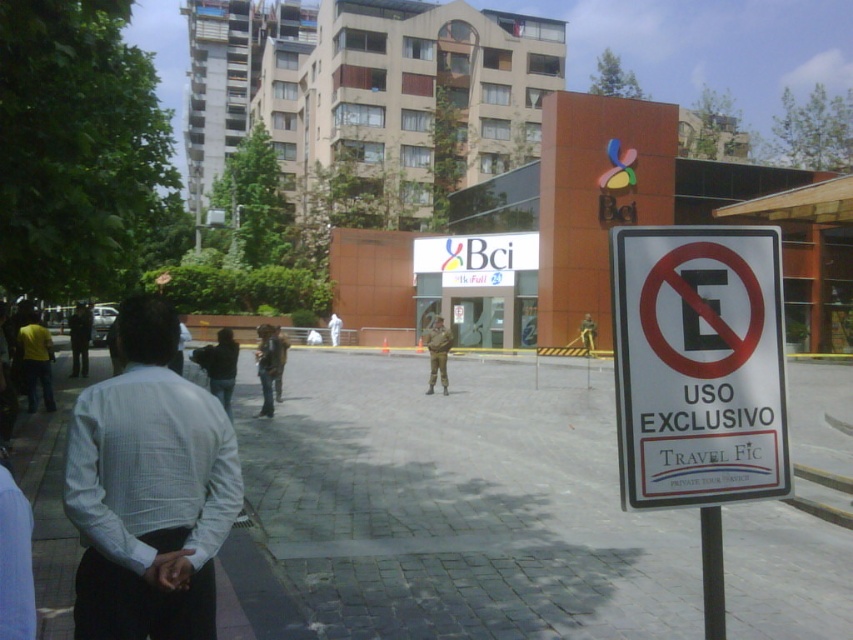
Is white plastic sign at lower right wider than camouflage uniform at center?

No.

Which of these two, white plastic sign at lower right or camouflage uniform at center, stands taller?

camouflage uniform at center

Which is behind, point (668, 241) or point (442, 376)?

The point (442, 376) is more distant.

You are a GUI agent. You are given a task and a screenshot of the screen. Output one action in this format:
    pyautogui.click(x=<x>, y=<y>)
    Task: Click on the white plastic sign at lower right
    
    Given the screenshot: What is the action you would take?
    pyautogui.click(x=698, y=364)

Which of these two, black metal pole at right or dark blue uniform at center, stands shorter?

black metal pole at right

How much distance is there between black metal pole at right and dark blue uniform at center?

The distance of black metal pole at right from dark blue uniform at center is 25.53 meters.

Which is behind, point (706, 566) or point (71, 353)?

The point (71, 353) is more distant.

This screenshot has width=853, height=640. Find the location of `black metal pole at right`. black metal pole at right is located at coordinates (712, 572).

Does point (184, 621) lie in front of point (76, 310)?

That is True.

Who is positioned more to the left, white checkered shirt at left or dark blue uniform at center?

dark blue uniform at center is more to the left.

Is point (115, 637) in front of point (88, 316)?

Yes, point (115, 637) is in front of point (88, 316).

The width and height of the screenshot is (853, 640). Find the location of `white checkered shirt at left`. white checkered shirt at left is located at coordinates (148, 490).